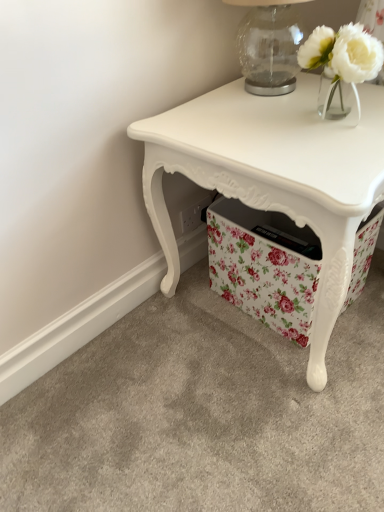
This screenshot has width=384, height=512. In order to click on vacant space situated on the left part of floral fabric storage box at lower center in this screenshot , I will do `click(195, 323)`.